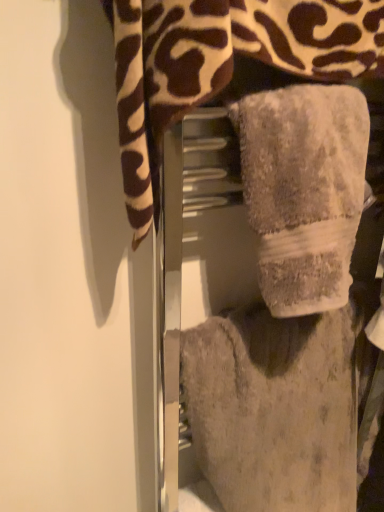
What do you see at coordinates (275, 408) in the screenshot?
I see `fuzzy gray towel at center, which ranks as the 1th towel in bottom-to-top order` at bounding box center [275, 408].

The image size is (384, 512). Describe the element at coordinates (220, 65) in the screenshot. I see `gray plush towel at center, positioned as the 1th towel in top-to-bottom order` at that location.

This screenshot has height=512, width=384. Find the location of `fuzzy gray towel at center, which ranks as the 1th towel in bottom-to-top order`. fuzzy gray towel at center, which ranks as the 1th towel in bottom-to-top order is located at coordinates (275, 408).

What's the angular difference between gray fluffy towel at center, which is counted as the 2th towel, starting from the bottom, and fuzzy gray towel at center, which ranks as the 1th towel in bottom-to-top order,'s facing directions?

There is a 0.000631-degree angle between the facing directions of gray fluffy towel at center, which is counted as the 2th towel, starting from the bottom, and fuzzy gray towel at center, which ranks as the 1th towel in bottom-to-top order.

Is gray fluffy towel at center, which is counted as the 2th towel, starting from the bottom, smaller than fuzzy gray towel at center, which ranks as the 1th towel in bottom-to-top order?

Correct, gray fluffy towel at center, which is counted as the 2th towel, starting from the bottom, occupies less space than fuzzy gray towel at center, which ranks as the 1th towel in bottom-to-top order.

Which object is positioned more to the right, gray fluffy towel at center, marked as the 2th towel in a top-to-bottom arrangement, or fuzzy gray towel at center, the 3th towel viewed from the top?

fuzzy gray towel at center, the 3th towel viewed from the top.

Could fuzzy gray towel at center, which ranks as the 1th towel in bottom-to-top order, be considered to be inside gray fluffy towel at center, which is counted as the 2th towel, starting from the bottom?

Definitely not — fuzzy gray towel at center, which ranks as the 1th towel in bottom-to-top order, is not inside gray fluffy towel at center, which is counted as the 2th towel, starting from the bottom.

Considering the relative sizes of gray plush towel at center, positioned as the 1th towel in top-to-bottom order, and gray fluffy towel at center, marked as the 2th towel in a top-to-bottom arrangement, in the image provided, is gray plush towel at center, positioned as the 1th towel in top-to-bottom order, taller than gray fluffy towel at center, marked as the 2th towel in a top-to-bottom arrangement,?

Yes.

Can you tell me how much gray plush towel at center, positioned as the 1th towel in top-to-bottom order, and gray fluffy towel at center, marked as the 2th towel in a top-to-bottom arrangement, differ in facing direction?

They differ by 0.00127 degrees in their facing directions.

From the image's perspective, which object appears higher, gray plush towel at center, the 3th towel when ordered from bottom to top, or gray fluffy towel at center, marked as the 2th towel in a top-to-bottom arrangement?

gray plush towel at center, the 3th towel when ordered from bottom to top, is shown above in the image.

Considering the sizes of objects gray plush towel at center, positioned as the 1th towel in top-to-bottom order, and fuzzy gray towel at center, which ranks as the 1th towel in bottom-to-top order, in the image provided, who is smaller, gray plush towel at center, positioned as the 1th towel in top-to-bottom order, or fuzzy gray towel at center, which ranks as the 1th towel in bottom-to-top order,?

gray plush towel at center, positioned as the 1th towel in top-to-bottom order.

Is gray plush towel at center, positioned as the 1th towel in top-to-bottom order, with fuzzy gray towel at center, the 3th towel viewed from the top?

There is a gap between gray plush towel at center, positioned as the 1th towel in top-to-bottom order, and fuzzy gray towel at center, the 3th towel viewed from the top.

Is gray plush towel at center, positioned as the 1th towel in top-to-bottom order, positioned behind fuzzy gray towel at center, the 3th towel viewed from the top?

No.

Where is `towel that is the 2nd one when counting forward from the fuzzy gray towel at center, the 3th towel viewed from the top`? towel that is the 2nd one when counting forward from the fuzzy gray towel at center, the 3th towel viewed from the top is located at coordinates (220, 65).

From the image's perspective, is fuzzy gray towel at center, which ranks as the 1th towel in bottom-to-top order, on top of gray plush towel at center, the 3th towel when ordered from bottom to top?

No, from the image's perspective, fuzzy gray towel at center, which ranks as the 1th towel in bottom-to-top order, is not on top of gray plush towel at center, the 3th towel when ordered from bottom to top.

In terms of height, does fuzzy gray towel at center, which ranks as the 1th towel in bottom-to-top order, look taller or shorter compared to gray plush towel at center, the 3th towel when ordered from bottom to top?

Considering their sizes, fuzzy gray towel at center, which ranks as the 1th towel in bottom-to-top order, has more height than gray plush towel at center, the 3th towel when ordered from bottom to top.

How different are the orientations of fuzzy gray towel at center, which ranks as the 1th towel in bottom-to-top order, and gray plush towel at center, positioned as the 1th towel in top-to-bottom order, in degrees?

fuzzy gray towel at center, which ranks as the 1th towel in bottom-to-top order, and gray plush towel at center, positioned as the 1th towel in top-to-bottom order, are facing 0.00189 degrees away from each other.

Are gray fluffy towel at center, which is counted as the 2th towel, starting from the bottom, and gray plush towel at center, positioned as the 1th towel in top-to-bottom order, far apart?

They are positioned close to each other.

Does gray fluffy towel at center, marked as the 2th towel in a top-to-bottom arrangement, have a smaller size compared to gray plush towel at center, the 3th towel when ordered from bottom to top?

Correct, gray fluffy towel at center, marked as the 2th towel in a top-to-bottom arrangement, occupies less space than gray plush towel at center, the 3th towel when ordered from bottom to top.

How far apart are gray fluffy towel at center, which is counted as the 2th towel, starting from the bottom, and gray plush towel at center, the 3th towel when ordered from bottom to top?

gray fluffy towel at center, which is counted as the 2th towel, starting from the bottom, is 4.52 inches from gray plush towel at center, the 3th towel when ordered from bottom to top.

From a real-world perspective, relative to gray plush towel at center, the 3th towel when ordered from bottom to top, is gray fluffy towel at center, which is counted as the 2th towel, starting from the bottom, vertically above or below?

gray fluffy towel at center, which is counted as the 2th towel, starting from the bottom, is situated lower than gray plush towel at center, the 3th towel when ordered from bottom to top, in the real world.

From a real-world perspective, is fuzzy gray towel at center, the 3th towel viewed from the top, positioned above or below gray fluffy towel at center, marked as the 2th towel in a top-to-bottom arrangement?

fuzzy gray towel at center, the 3th towel viewed from the top, is situated lower than gray fluffy towel at center, marked as the 2th towel in a top-to-bottom arrangement, in the real world.

Is fuzzy gray towel at center, the 3th towel viewed from the top, in front of gray fluffy towel at center, marked as the 2th towel in a top-to-bottom arrangement?

No, it is not.

Could gray fluffy towel at center, marked as the 2th towel in a top-to-bottom arrangement, be considered to be inside fuzzy gray towel at center, the 3th towel viewed from the top?

No, gray fluffy towel at center, marked as the 2th towel in a top-to-bottom arrangement, is not a part of fuzzy gray towel at center, the 3th towel viewed from the top.

Is fuzzy gray towel at center, which ranks as the 1th towel in bottom-to-top order, oriented away from gray fluffy towel at center, marked as the 2th towel in a top-to-bottom arrangement?

No.

At what (x,y) coordinates should I click in order to perform the action: click on the 1st towel to the left of the fuzzy gray towel at center, the 3th towel viewed from the top, starting your count from the anchor. Please return your answer as a coordinate pair (x, y). The image size is (384, 512). Looking at the image, I should click on (304, 191).

Where is `the 1st towel positioned below the gray plush towel at center, the 3th towel when ordered from bottom to top (from a real-world perspective)`? This screenshot has height=512, width=384. the 1st towel positioned below the gray plush towel at center, the 3th towel when ordered from bottom to top (from a real-world perspective) is located at coordinates (304, 191).

From the image, which object appears to be farther from fuzzy gray towel at center, the 3th towel viewed from the top, gray fluffy towel at center, marked as the 2th towel in a top-to-bottom arrangement, or gray plush towel at center, the 3th towel when ordered from bottom to top?

gray plush towel at center, the 3th towel when ordered from bottom to top, lies further to fuzzy gray towel at center, the 3th towel viewed from the top, than the other object.

When comparing their distances from gray fluffy towel at center, which is counted as the 2th towel, starting from the bottom, does fuzzy gray towel at center, which ranks as the 1th towel in bottom-to-top order, or gray plush towel at center, positioned as the 1th towel in top-to-bottom order, seem further?

fuzzy gray towel at center, which ranks as the 1th towel in bottom-to-top order.

Which object lies nearer to the anchor point gray plush towel at center, positioned as the 1th towel in top-to-bottom order, fuzzy gray towel at center, which ranks as the 1th towel in bottom-to-top order, or gray fluffy towel at center, marked as the 2th towel in a top-to-bottom arrangement?

Based on the image, gray fluffy towel at center, marked as the 2th towel in a top-to-bottom arrangement, appears to be nearer to gray plush towel at center, positioned as the 1th towel in top-to-bottom order.

Consider the image. When comparing their distances from fuzzy gray towel at center, the 3th towel viewed from the top, does gray plush towel at center, the 3th towel when ordered from bottom to top, or gray fluffy towel at center, which is counted as the 2th towel, starting from the bottom, seem closer?

Based on the image, gray fluffy towel at center, which is counted as the 2th towel, starting from the bottom, appears to be nearer to fuzzy gray towel at center, the 3th towel viewed from the top.

Looking at this image, considering their positions, is gray plush towel at center, positioned as the 1th towel in top-to-bottom order, positioned closer to gray fluffy towel at center, which is counted as the 2th towel, starting from the bottom, than fuzzy gray towel at center, which ranks as the 1th towel in bottom-to-top order?

gray plush towel at center, positioned as the 1th towel in top-to-bottom order, is closer to gray fluffy towel at center, which is counted as the 2th towel, starting from the bottom.

Looking at the image, which one is located closer to gray plush towel at center, positioned as the 1th towel in top-to-bottom order, gray fluffy towel at center, which is counted as the 2th towel, starting from the bottom, or fuzzy gray towel at center, the 3th towel viewed from the top?

The object closer to gray plush towel at center, positioned as the 1th towel in top-to-bottom order, is gray fluffy towel at center, which is counted as the 2th towel, starting from the bottom.

Locate an element on the screen. The image size is (384, 512). towel between gray plush towel at center, positioned as the 1th towel in top-to-bottom order, and fuzzy gray towel at center, the 3th towel viewed from the top, in the up-down direction is located at coordinates (304, 191).